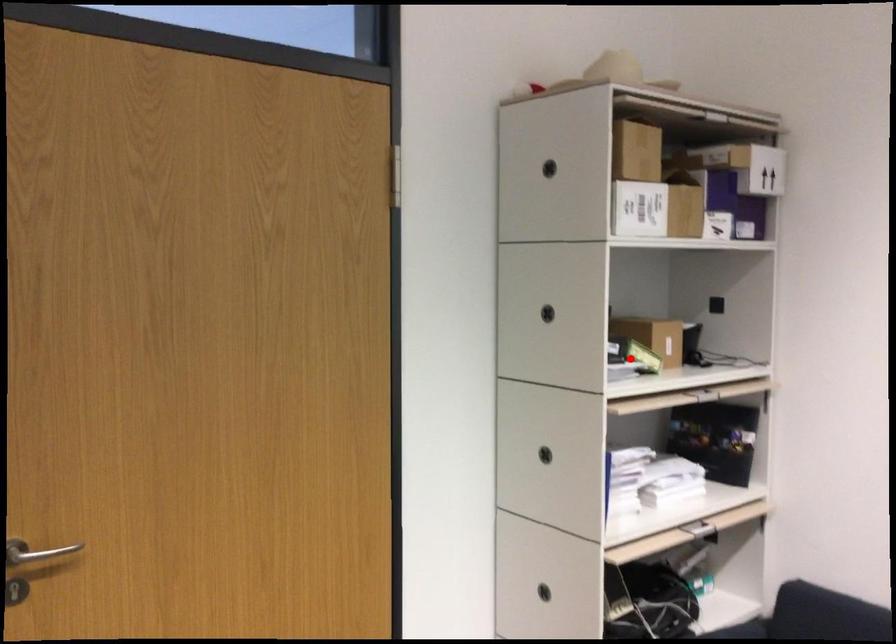
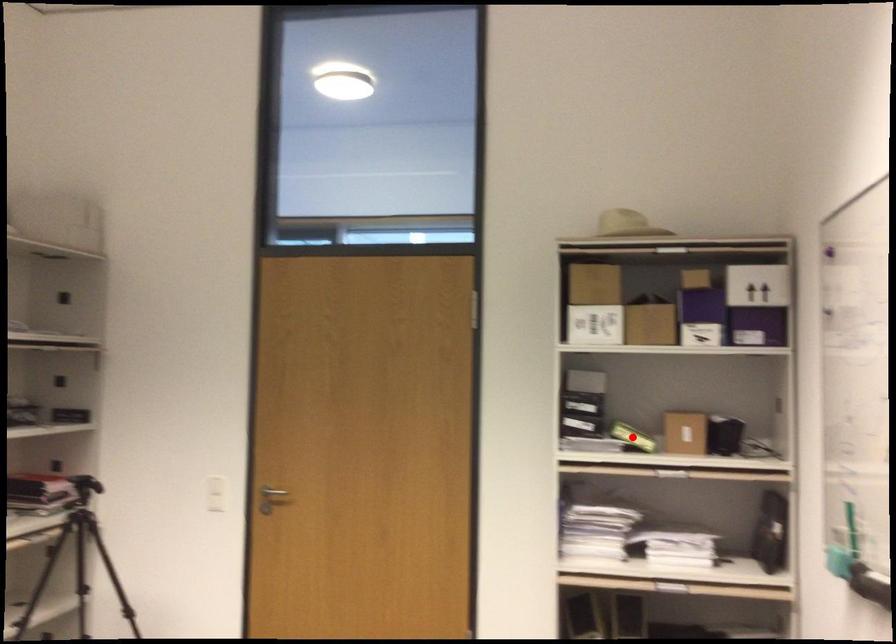
I am providing you with two images of the same scene from different viewpoints. A red point is marked on the first image and another point is marked on the second image. Do the highlighted points in image1 and image2 indicate the same real-world spot?

Yes